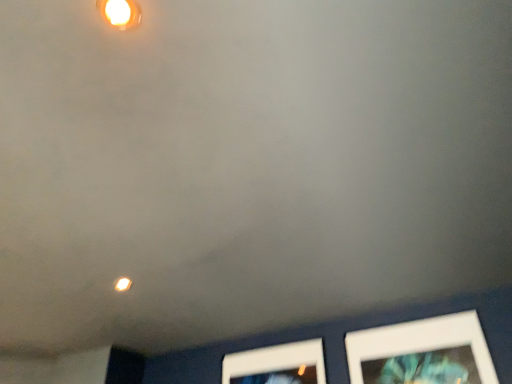
Question: Does matte yellow light at upper left have a smaller size compared to matte white light fixture at upper center?

Choices:
 (A) yes
 (B) no

Answer: (B)

Question: From a real-world perspective, is matte yellow light at upper left under matte white light fixture at upper center?

Choices:
 (A) yes
 (B) no

Answer: (B)

Question: Is matte yellow light at upper left positioned far away from matte white light fixture at upper center?

Choices:
 (A) yes
 (B) no

Answer: (A)

Question: Can you confirm if matte yellow light at upper left is thinner than matte white light fixture at upper center?

Choices:
 (A) yes
 (B) no

Answer: (B)

Question: Is matte yellow light at upper left to the right of matte white light fixture at upper center from the viewer's perspective?

Choices:
 (A) yes
 (B) no

Answer: (B)

Question: Does point (112, 3) appear closer or farther from the camera than point (117, 289)?

Choices:
 (A) farther
 (B) closer

Answer: (B)

Question: Do you think matte white light fixture at upper center is within matte yellow light at upper left, or outside of it?

Choices:
 (A) outside
 (B) inside

Answer: (A)

Question: Looking at the image, does matte white light fixture at upper center seem bigger or smaller compared to matte yellow light at upper left?

Choices:
 (A) small
 (B) big

Answer: (A)

Question: In the image, is matte white light fixture at upper center positioned in front of or behind matte yellow light at upper left?

Choices:
 (A) behind
 (B) front

Answer: (B)

Question: In the image, is matte white light fixture at upper center positioned in front of or behind white matte picture frame at lower right?

Choices:
 (A) front
 (B) behind

Answer: (A)

Question: Based on their positions, is matte white light fixture at upper center located to the left or right of white matte picture frame at lower right?

Choices:
 (A) left
 (B) right

Answer: (A)

Question: In terms of size, does matte white light fixture at upper center appear bigger or smaller than white matte picture frame at lower right?

Choices:
 (A) big
 (B) small

Answer: (B)

Question: Is matte white light fixture at upper center inside the boundaries of white matte picture frame at lower right, or outside?

Choices:
 (A) outside
 (B) inside

Answer: (A)

Question: In the image, is white matte picture frame at lower right positioned in front of or behind matte yellow light at upper left?

Choices:
 (A) front
 (B) behind

Answer: (A)

Question: From a real-world perspective, is white matte picture frame at lower right positioned above or below matte yellow light at upper left?

Choices:
 (A) below
 (B) above

Answer: (A)